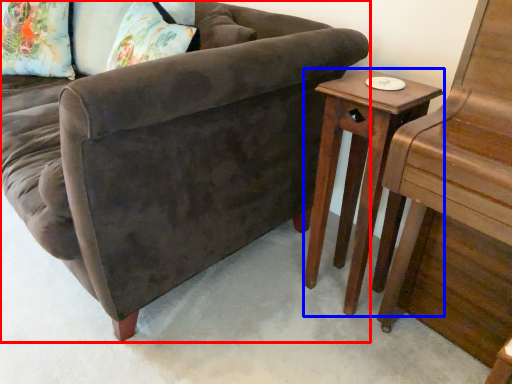
Question: Which object is closer to the camera taking this photo, studio couch (highlighted by a red box) or table (highlighted by a blue box)?

Choices:
 (A) studio couch
 (B) table

Answer: (A)